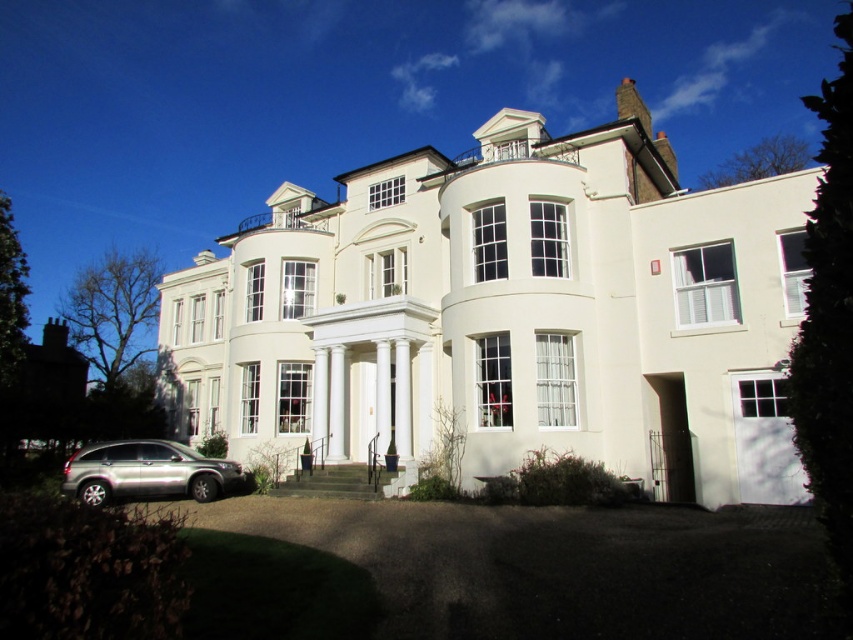
In the scene shown: You are a delivery person standing at the entrance of the white glossy mansion at center. You need to deliver a package to the silver metallic suv at lower left. The delivery robot you use has a maximum range of 20 meters. Can the robot reach the suv from the mansion?

The white glossy mansion at center and silver metallic suv at lower left are 17.78 meters apart. Since the robot has a maximum range of 20 meters, it can reach the silver metallic suv at lower left from the white glossy mansion at center.

You are a delivery person approaching the building and need to park your vehicle. You see the dark asphalt driveway at lower center and the silver metallic suv at lower left. Which parking spot is closer to the entrance of the building?

The dark asphalt driveway at lower center is closer to the viewer than the silver metallic suv at lower left, so the driveway is closer to the entrance.